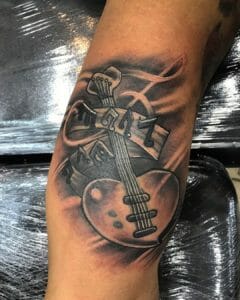
Locate an element on the screen. board is located at coordinates pyautogui.click(x=154, y=152).